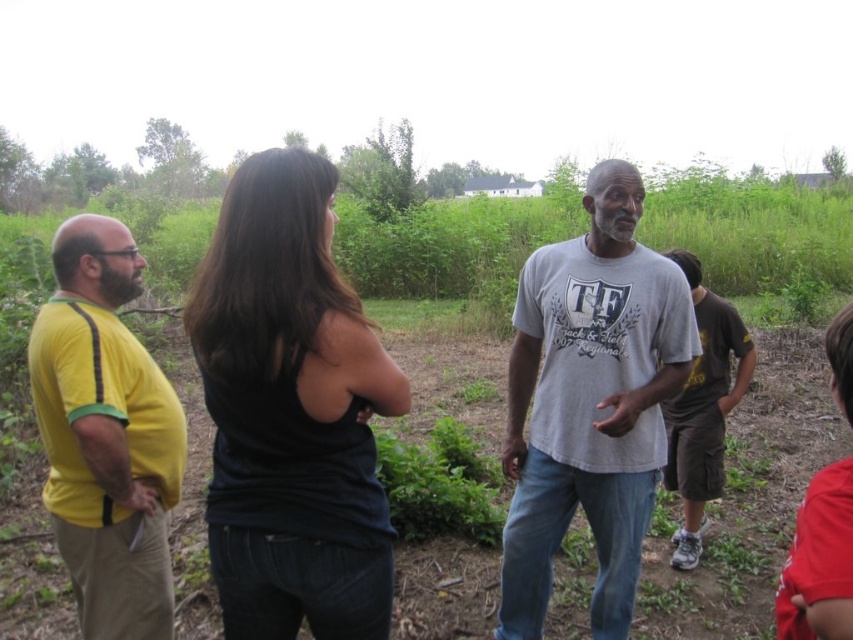
Question: Which object is closer to the camera taking this photo?

Choices:
 (A) yellow cotton shirt at left
 (B) gray cotton t-shirt at center

Answer: (A)

Question: Observing the image, what is the correct spatial positioning of black matte tank top at center in reference to gray cotton t-shirt at center?

Choices:
 (A) left
 (B) right

Answer: (A)

Question: Does black matte tank top at center appear on the left side of gray cotton t-shirt at center?

Choices:
 (A) no
 (B) yes

Answer: (B)

Question: In this image, where is black matte tank top at center located relative to yellow cotton shirt at left?

Choices:
 (A) right
 (B) left

Answer: (A)

Question: Which point is farther to the camera?

Choices:
 (A) gray cotton t-shirt at center
 (B) black matte tank top at center
 (C) yellow cotton shirt at left

Answer: (A)

Question: Which point is farther from the camera taking this photo?

Choices:
 (A) (611, 244)
 (B) (219, 596)

Answer: (A)